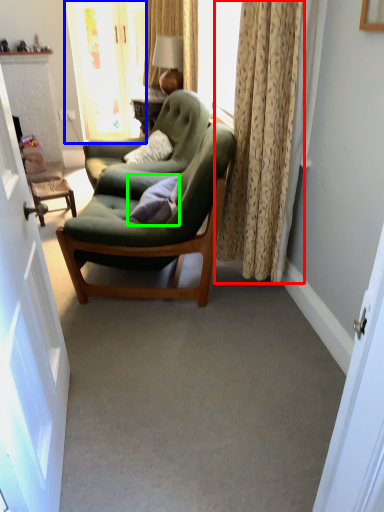
Question: Which is nearer to the curtain (highlighted by a red box)? glass door (highlighted by a blue box) or pillow (highlighted by a green box).

Choices:
 (A) glass door
 (B) pillow

Answer: (B)